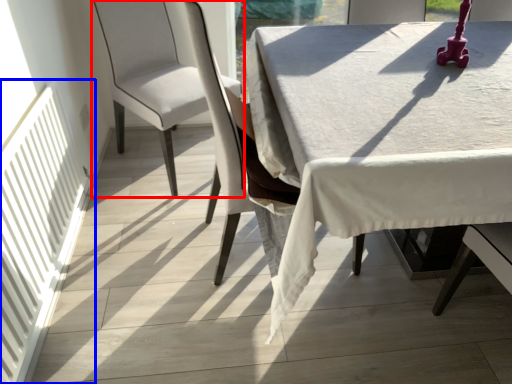
Question: Which point is closer to the camera, chair (highlighted by a red box) or radiator (highlighted by a blue box)?

Choices:
 (A) chair
 (B) radiator

Answer: (B)